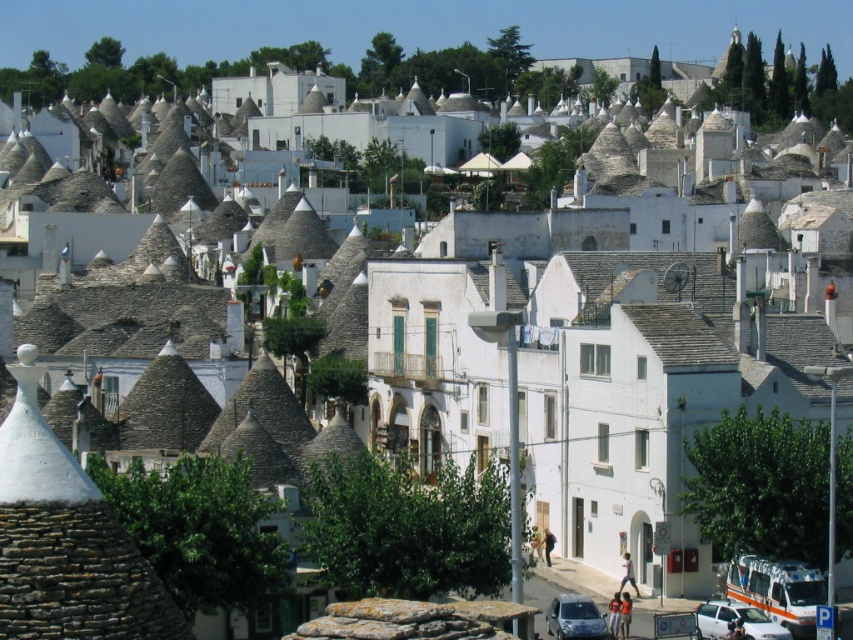
You are a tourist standing at the entrance of the town square. You see a metallic silver car at lower right and a silver metallic hatchback at lower center. Which vehicle is closer to you?

The metallic silver car at lower right is closer to you because it is in front of the silver metallic hatchback at lower center.

You are a visitor in this town and want to park your car. You see a metallic silver car at lower right and a silver metallic hatchback at lower center. Which parking spot is available if the hatchback is blocking the car?

The metallic silver car at lower right is positioned under the silver metallic hatchback at lower center, meaning the hatchback is blocking access to the car. Therefore, the parking spot for the metallic silver car at lower right is unavailable. The silver metallic hatchback at lower center is parked in its own spot, so its spot is occupied. Hence, neither spot is available.